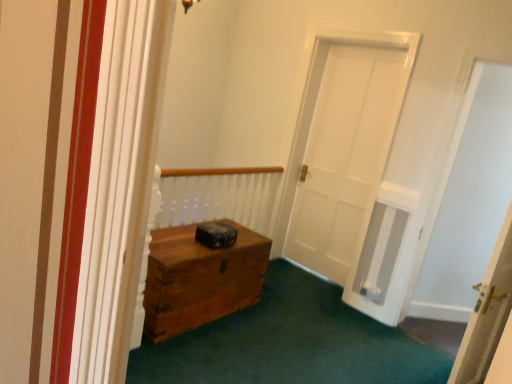
Question: From the image's perspective, would you say white matte door at right is shown under white wooden door at right?

Choices:
 (A) no
 (B) yes

Answer: (A)

Question: Is white wooden door at right at the back of white matte door at right?

Choices:
 (A) no
 (B) yes

Answer: (A)

Question: Does white matte door at right appear on the left side of white wooden door at right?

Choices:
 (A) yes
 (B) no

Answer: (B)

Question: Is white wooden door at right surrounded by white matte door at right?

Choices:
 (A) yes
 (B) no

Answer: (B)

Question: From a real-world perspective, is white matte door at right positioned under white wooden door at right based on gravity?

Choices:
 (A) no
 (B) yes

Answer: (A)

Question: Does white matte door at right have a greater width compared to white wooden door at right?

Choices:
 (A) no
 (B) yes

Answer: (A)

Question: Can you confirm if white wooden door at right is thinner than white matte door at right?

Choices:
 (A) no
 (B) yes

Answer: (A)

Question: From a real-world perspective, is white wooden door at right below white matte door at right?

Choices:
 (A) yes
 (B) no

Answer: (A)

Question: Can you confirm if white wooden door at right is shorter than white matte door at right?

Choices:
 (A) no
 (B) yes

Answer: (B)

Question: Considering the relative sizes of white wooden door at right and white matte door at right in the image provided, is white wooden door at right taller than white matte door at right?

Choices:
 (A) no
 (B) yes

Answer: (A)

Question: Is white wooden door at right positioned with its back to white matte door at right?

Choices:
 (A) no
 (B) yes

Answer: (A)

Question: From a real-world perspective, is white wooden door at right over white matte door at right?

Choices:
 (A) yes
 (B) no

Answer: (B)

Question: Is white wooden door at right situated inside white matte door at right or outside?

Choices:
 (A) outside
 (B) inside

Answer: (A)